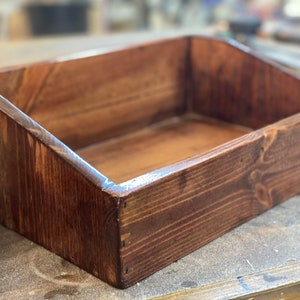
Identify the location of inide right corner of wooden box. The image size is (300, 300). (202, 40).